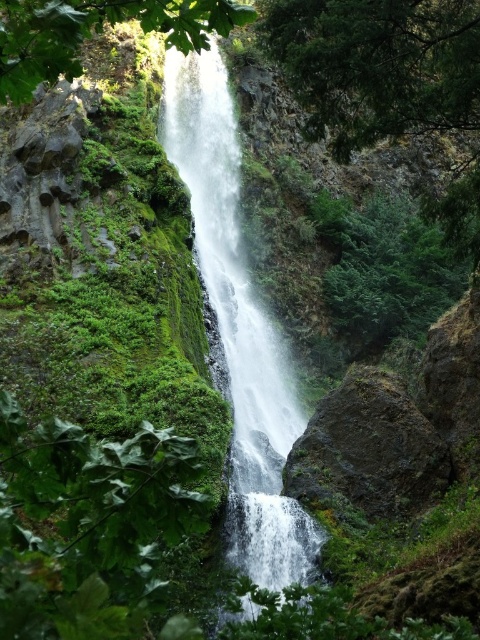
Question: Does green leafy tree at upper right have a smaller size compared to green leafy tree at upper center?

Choices:
 (A) yes
 (B) no

Answer: (B)

Question: Is green leafy tree at upper right above green leafy tree at upper center?

Choices:
 (A) yes
 (B) no

Answer: (A)

Question: Does green leafy tree at upper right come in front of green leafy tree at upper center?

Choices:
 (A) yes
 (B) no

Answer: (B)

Question: Which object is the closest to the green leafy tree at upper right?

Choices:
 (A) green leafy tree at upper center
 (B) white frothy water at center

Answer: (B)

Question: Based on their relative distances, which object is farther from the green leafy tree at upper right?

Choices:
 (A) white frothy water at center
 (B) green leafy tree at upper center

Answer: (B)

Question: Which of the following is the closest to the observer?

Choices:
 (A) (370, 120)
 (B) (207, 269)
 (C) (103, 19)

Answer: (C)